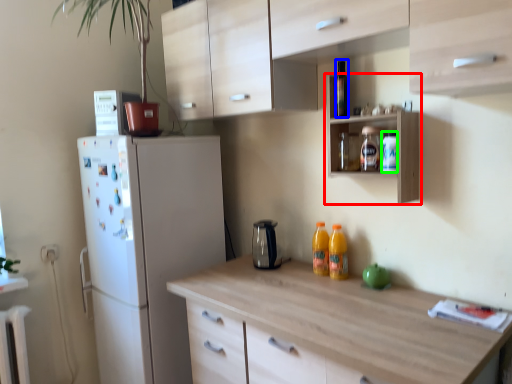
Question: Which is nearer to the shelf (highlighted by a red box)? bottle (highlighted by a blue box) or bottle (highlighted by a green box).

Choices:
 (A) bottle
 (B) bottle

Answer: (B)